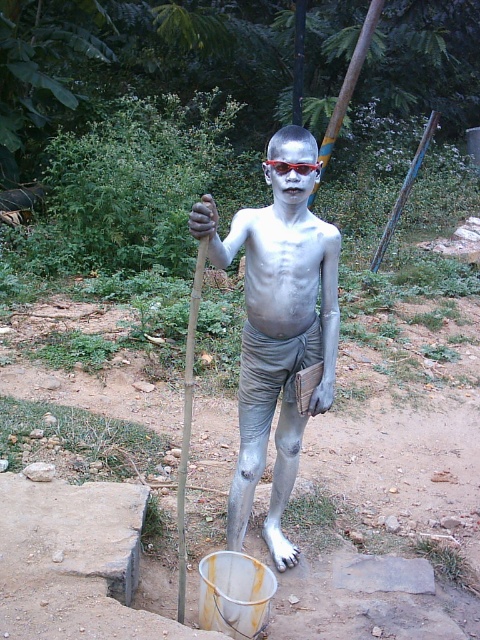
Question: Is matte silver body paint at center positioned behind red plastic goggles at center?

Choices:
 (A) no
 (B) yes

Answer: (A)

Question: Which of the following is the farthest from the observer?

Choices:
 (A) matte silver body paint at center
 (B) red plastic goggles at center

Answer: (B)

Question: Which point is closer to the camera?

Choices:
 (A) matte silver body paint at center
 (B) red plastic goggles at center

Answer: (A)

Question: Which point is farther to the camera?

Choices:
 (A) red plastic goggles at center
 (B) matte silver body paint at center

Answer: (A)

Question: Can you confirm if matte silver body paint at center is bigger than red plastic goggles at center?

Choices:
 (A) no
 (B) yes

Answer: (B)

Question: Does matte silver body paint at center appear over red plastic goggles at center?

Choices:
 (A) no
 (B) yes

Answer: (A)